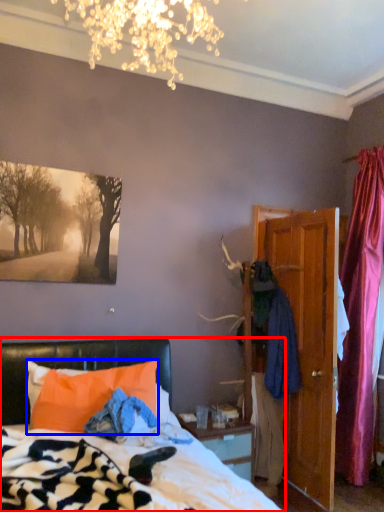
Question: Which object appears closest to the camera in this image, bed (highlighted by a red box) or pillow (highlighted by a blue box)?

Choices:
 (A) bed
 (B) pillow

Answer: (A)